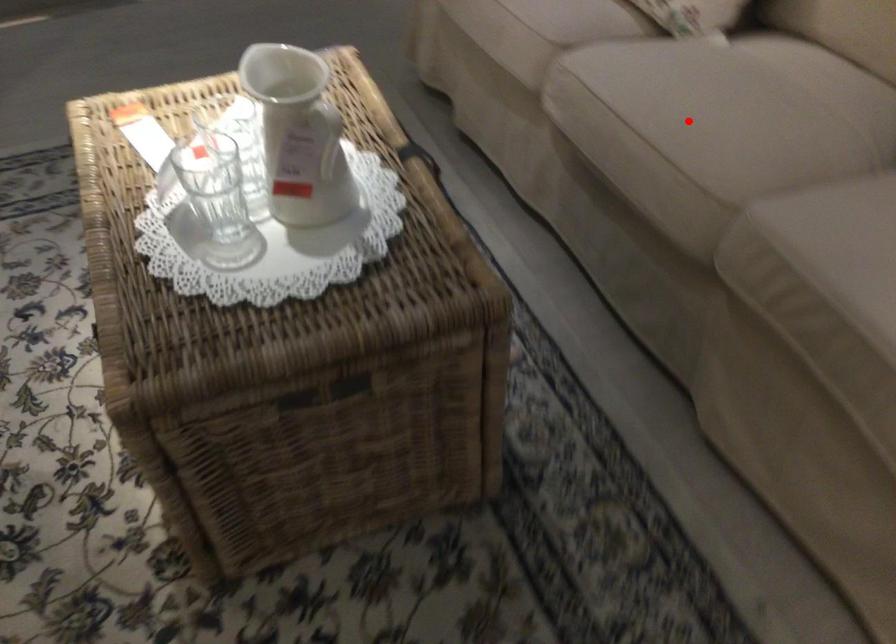
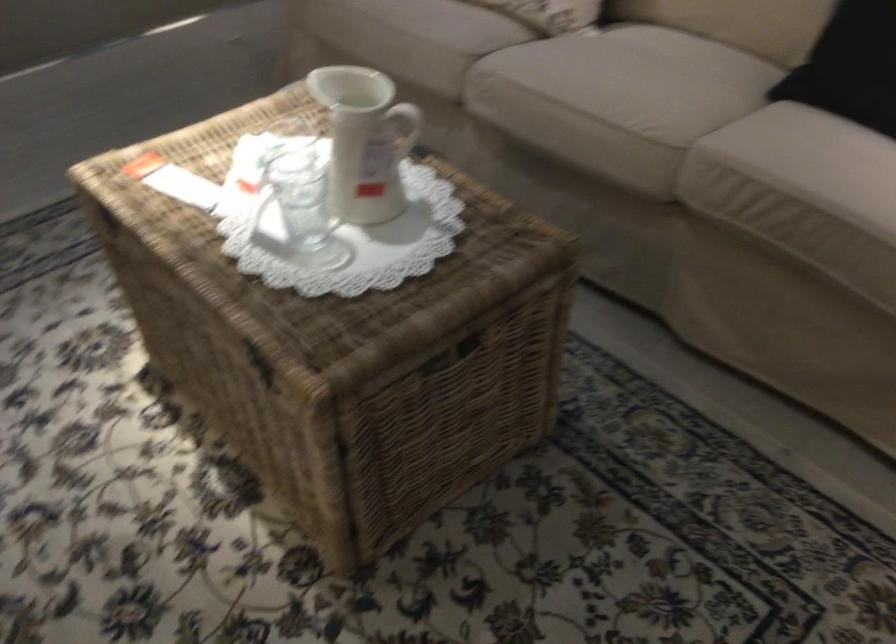
Question: I am providing you with two images of the same scene from different viewpoints. Image1 has a red point marked. In image2, the corresponding 3D location appears at what relative position? Reply with the corresponding letter.

Choices:
 (A) Closer
 (B) Farther

Answer: (B)